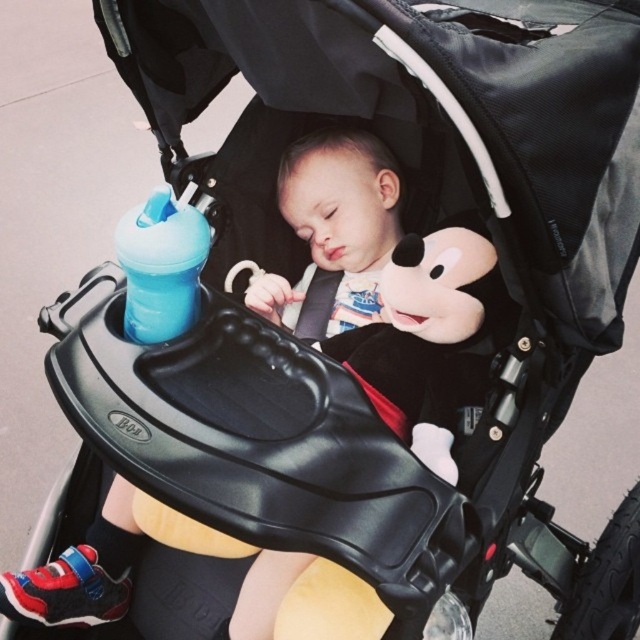
From the picture: Does soft plush mickey mouse at center appear under blue plastic bottle at upper left?

Yes.

Who is lower down, soft plush mickey mouse at center or blue plastic bottle at upper left?

soft plush mickey mouse at center

This screenshot has width=640, height=640. I want to click on soft plush mickey mouse at center, so click(428, 337).